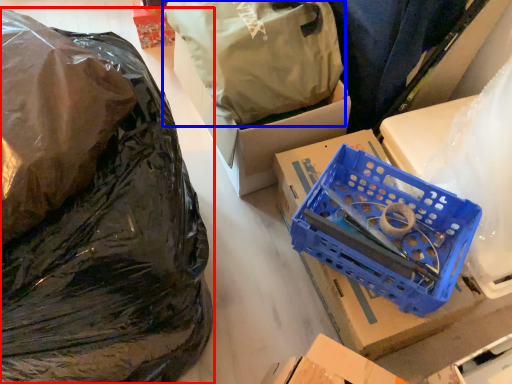
Question: Which object appears farthest to the camera in this image, plastic bag (highlighted by a red box) or plastic bag (highlighted by a blue box)?

Choices:
 (A) plastic bag
 (B) plastic bag

Answer: (B)